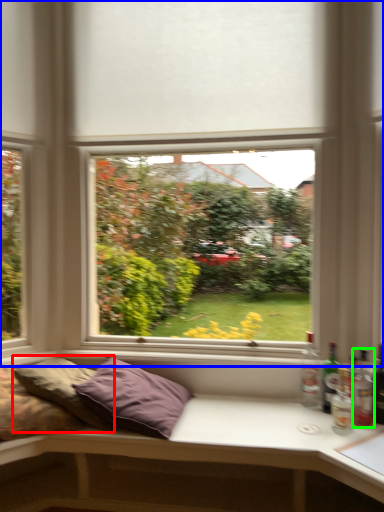
Question: Which object is positioned farthest from pillow (highlighted by a red box)? Select from window (highlighted by a blue box) and bottle (highlighted by a green box).

Choices:
 (A) window
 (B) bottle

Answer: (B)